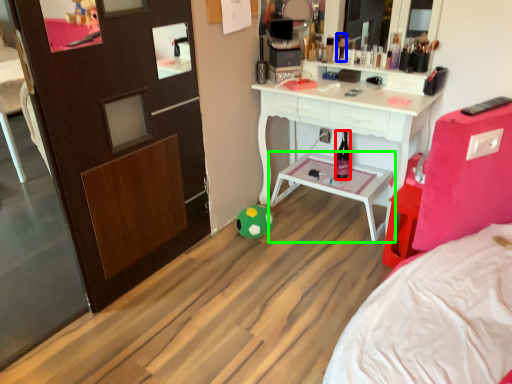
Question: Based on their relative distances, which object is nearer to bottle (highlighted by a red box)? Choose from toiletry (highlighted by a blue box) and table (highlighted by a green box).

Choices:
 (A) toiletry
 (B) table

Answer: (B)